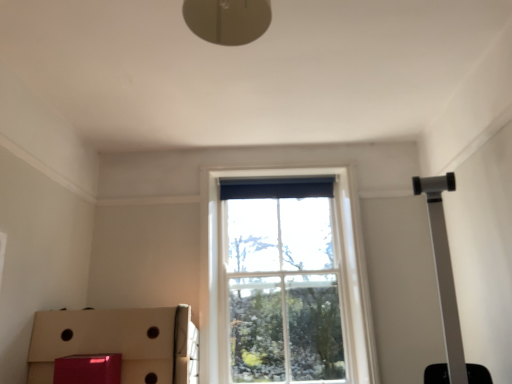
Question: Based on their positions, is cardboard box at lower left located to the left or right of clear glass window at center?

Choices:
 (A) right
 (B) left

Answer: (B)

Question: Is cardboard box at lower left bigger or smaller than clear glass window at center?

Choices:
 (A) small
 (B) big

Answer: (B)

Question: Is cardboard box at lower left in front of or behind clear glass window at center in the image?

Choices:
 (A) behind
 (B) front

Answer: (B)

Question: From the image's perspective, relative to cardboard box at lower left, is clear glass window at center above or below?

Choices:
 (A) above
 (B) below

Answer: (A)

Question: In the image, is clear glass window at center positioned in front of or behind cardboard box at lower left?

Choices:
 (A) front
 (B) behind

Answer: (B)

Question: From a real-world perspective, is clear glass window at center positioned above or below cardboard box at lower left?

Choices:
 (A) above
 (B) below

Answer: (A)

Question: Is clear glass window at center inside or outside of cardboard box at lower left?

Choices:
 (A) inside
 (B) outside

Answer: (B)